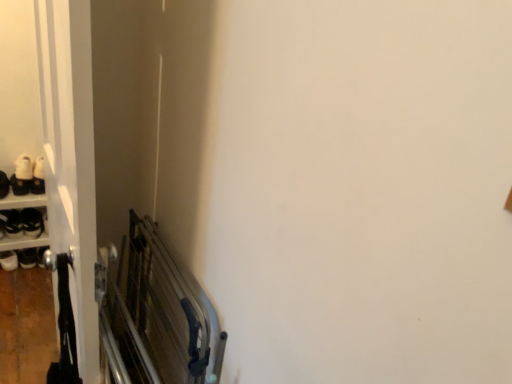
Question: In terms of size, does white matte shoe at upper left, which appears as the first footwear when viewed from the top, appear bigger or smaller than white matte shoe at left, which is the first footwear from bottom to top?

Choices:
 (A) small
 (B) big

Answer: (A)

Question: Would you say white matte shoe at upper left, the second footwear when ordered from bottom to top, is to the left or to the right of white matte shoe at left, the second footwear in the top-to-bottom sequence, in the picture?

Choices:
 (A) right
 (B) left

Answer: (A)

Question: Which object is positioned farthest from the white matte shoe at upper left, the second footwear when ordered from bottom to top?

Choices:
 (A) white glossy door at left
 (B) white matte shoe at left, the second footwear in the top-to-bottom sequence

Answer: (A)

Question: Which is farther from the white matte shoe at left, the second footwear in the top-to-bottom sequence?

Choices:
 (A) white glossy door at left
 (B) white matte shoe at upper left, which appears as the first footwear when viewed from the top

Answer: (A)